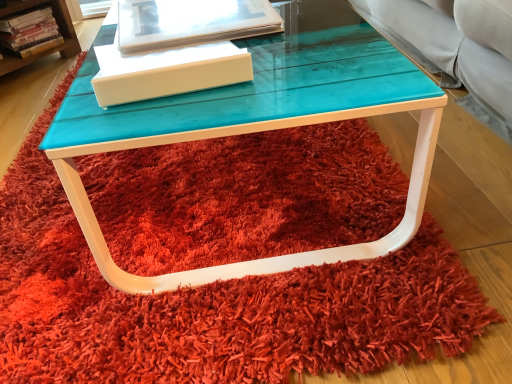
Where is `free point above hardcover book at left, the 2th book when ordered from right to left (from a real-world perspective)`? The width and height of the screenshot is (512, 384). free point above hardcover book at left, the 2th book when ordered from right to left (from a real-world perspective) is located at coordinates (25, 6).